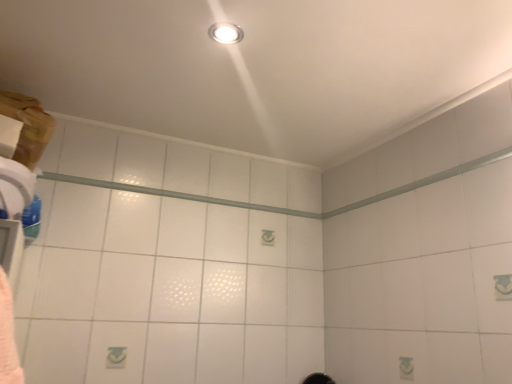
Locate an element on the screen. clear glass beam at upper center is located at coordinates (175, 195).

What do you see at coordinates (175, 195) in the screenshot? I see `clear glass beam at upper center` at bounding box center [175, 195].

What do you see at coordinates (226, 33) in the screenshot? I see `matte silver light fixture at upper center` at bounding box center [226, 33].

Locate an element on the screen. This screenshot has width=512, height=384. matte silver light fixture at upper center is located at coordinates (226, 33).

The width and height of the screenshot is (512, 384). I want to click on clear glass beam at upper center, so click(x=175, y=195).

Visually, is clear glass beam at upper center positioned to the left or to the right of matte silver light fixture at upper center?

In the image, clear glass beam at upper center appears on the left side of matte silver light fixture at upper center.

Between clear glass beam at upper center and matte silver light fixture at upper center, which one is positioned in front?

matte silver light fixture at upper center.

Is point (42, 172) closer or farther from the camera than point (212, 37)?

Point (42, 172) is farther from the camera than point (212, 37).

From the image's perspective, is clear glass beam at upper center on top of matte silver light fixture at upper center?

No, from the image's perspective, clear glass beam at upper center is not above matte silver light fixture at upper center.

From a real-world perspective, which is physically below, clear glass beam at upper center or matte silver light fixture at upper center?

In real-world perspective, clear glass beam at upper center is lower.

Does clear glass beam at upper center have a greater width compared to matte silver light fixture at upper center?

In fact, clear glass beam at upper center might be narrower than matte silver light fixture at upper center.

Considering the relative sizes of clear glass beam at upper center and matte silver light fixture at upper center in the image provided, is clear glass beam at upper center taller than matte silver light fixture at upper center?

Indeed, clear glass beam at upper center has a greater height compared to matte silver light fixture at upper center.

Between clear glass beam at upper center and matte silver light fixture at upper center, which one has smaller size?

matte silver light fixture at upper center is smaller.

Is clear glass beam at upper center located outside matte silver light fixture at upper center?

Yes, clear glass beam at upper center is outside of matte silver light fixture at upper center.

Can you see clear glass beam at upper center touching matte silver light fixture at upper center?

No, clear glass beam at upper center is not beside matte silver light fixture at upper center.

Is clear glass beam at upper center turned away from matte silver light fixture at upper center?

No, clear glass beam at upper center is not facing the opposite direction of matte silver light fixture at upper center.

Identify the location of light fixture located in front of the clear glass beam at upper center. The width and height of the screenshot is (512, 384). (226, 33).

Considering the relative positions of matte silver light fixture at upper center and clear glass beam at upper center in the image provided, is matte silver light fixture at upper center to the left of clear glass beam at upper center from the viewer's perspective?

Incorrect, matte silver light fixture at upper center is not on the left side of clear glass beam at upper center.

Which object is closer to the camera taking this photo, matte silver light fixture at upper center or clear glass beam at upper center?

matte silver light fixture at upper center is closer to the camera.

Which is farther, (233, 32) or (206, 200)?

Positioned behind is point (206, 200).

From the image's perspective, between matte silver light fixture at upper center and clear glass beam at upper center, which one is located above?

matte silver light fixture at upper center is shown above in the image.

From a real-world perspective, which is physically above, matte silver light fixture at upper center or clear glass beam at upper center?

In real-world perspective, matte silver light fixture at upper center is above.

Is matte silver light fixture at upper center wider or thinner than clear glass beam at upper center?

Considering their sizes, matte silver light fixture at upper center looks broader than clear glass beam at upper center.

Looking at this image, considering the relative sizes of matte silver light fixture at upper center and clear glass beam at upper center in the image provided, is matte silver light fixture at upper center shorter than clear glass beam at upper center?

Yes.

Based on their sizes in the image, would you say matte silver light fixture at upper center is bigger or smaller than clear glass beam at upper center?

matte silver light fixture at upper center is smaller than clear glass beam at upper center.

Can we say matte silver light fixture at upper center lies outside clear glass beam at upper center?

Indeed, matte silver light fixture at upper center is completely outside clear glass beam at upper center.

Is matte silver light fixture at upper center touching clear glass beam at upper center?

matte silver light fixture at upper center and clear glass beam at upper center are not in contact.

Is matte silver light fixture at upper center oriented towards clear glass beam at upper center?

No, matte silver light fixture at upper center is not facing towards clear glass beam at upper center.

What's the angular difference between matte silver light fixture at upper center and clear glass beam at upper center's facing directions?

3.4 degrees.

Consider the image. How far apart are matte silver light fixture at upper center and clear glass beam at upper center?

A distance of 84.21 centimeters exists between matte silver light fixture at upper center and clear glass beam at upper center.

You are a GUI agent. You are given a task and a screenshot of the screen. Output one action in this format:
    pyautogui.click(x=<x>, y=<y>)
    Task: Click on the beam below the matte silver light fixture at upper center (from the image's perspective)
    The height and width of the screenshot is (384, 512).
    Given the screenshot: What is the action you would take?
    pyautogui.click(x=175, y=195)

The width and height of the screenshot is (512, 384). I want to click on beam on the left side of matte silver light fixture at upper center, so click(x=175, y=195).

At what (x,y) coordinates should I click in order to perform the action: click on light fixture above the clear glass beam at upper center (from the image's perspective). Please return your answer as a coordinate pair (x, y). The width and height of the screenshot is (512, 384). Looking at the image, I should click on (226, 33).